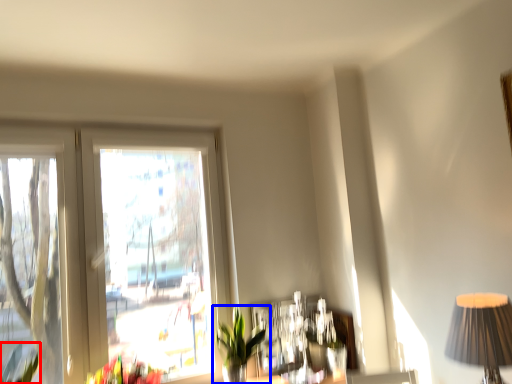
Question: Which object appears farthest to the camera in this image, plant (highlighted by a red box) or houseplant (highlighted by a blue box)?

Choices:
 (A) plant
 (B) houseplant

Answer: (B)